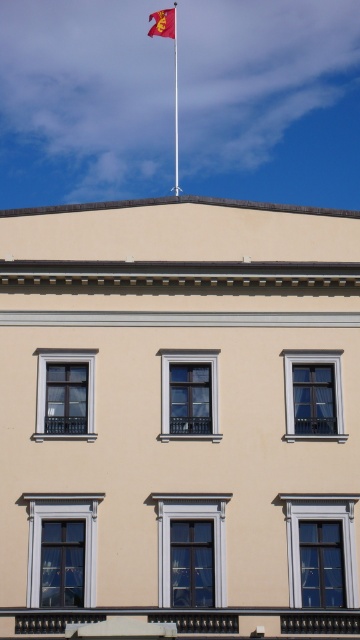
Based on the scene description, what object is located at the coordinates point (163, 22)?

The red fabric flag at upper center is located at point (163, 22).

You are standing in front of the classical building and notice two red fabric items at the upper center of the building. Which one is positioned higher between the red fabric flag at upper center and the red fabric flagpole at upper center?

The red fabric flag at upper center is located above the red fabric flagpole at upper center, so it is positioned higher.

You are an architect designing a scale model of this building. You need to ensure the red fabric flag at upper center and the red fabric flagpole at upper center are proportionally accurate. Which object should be made larger in the model?

The red fabric flag at upper center should be made larger in the model since it has a larger size compared to the red fabric flagpole at upper center according to the description.